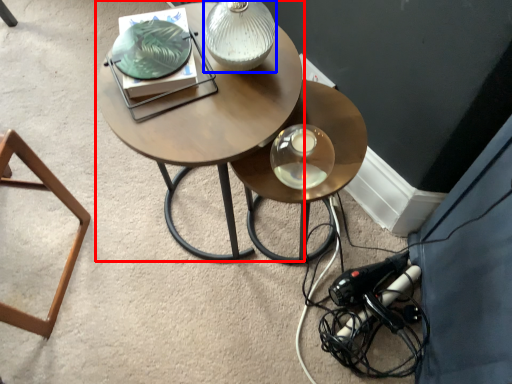
Question: Which object is further to the camera taking this photo, coffee table (highlighted by a red box) or table lamp (highlighted by a blue box)?

Choices:
 (A) coffee table
 (B) table lamp

Answer: (A)